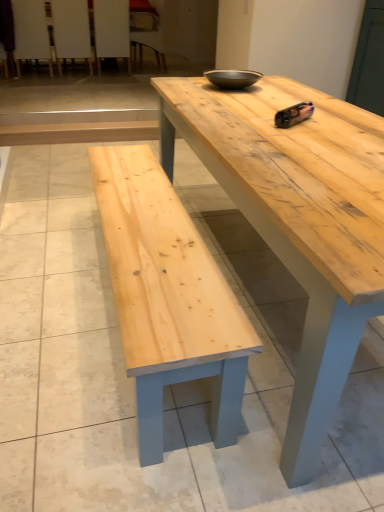
Image resolution: width=384 pixels, height=512 pixels. I want to click on free space in front of matte black bowl at center, so click(241, 96).